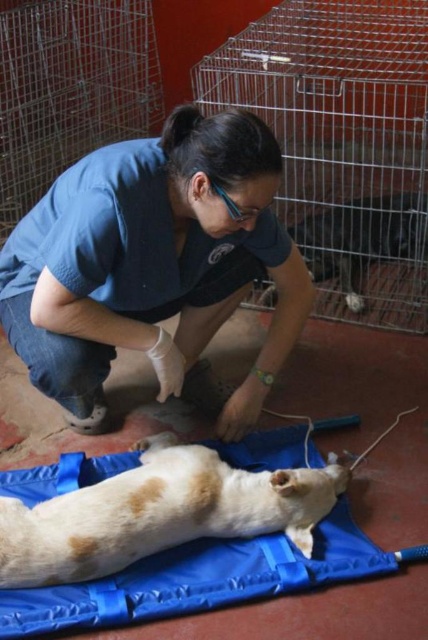
You are a veterinary assistant and need to place a new blue fabric mat in the examination room. The current blue fabric at center is already there. How does the size of the new mat compare to the white fur dog at center?

The blue fabric at center is bigger than the white fur dog at center, so the new blue fabric mat should be at least as large as the existing one to accommodate the dog properly.

You are a veterinarian trying to place a bandage on the dog. The bandage is 12 inches long. Can you fit the bandage between the blue fabric at center and the light brown fur at center without overlapping either?

The blue fabric at center and light brown fur at center are 17.20 inches apart. Since the bandage is only 12 inches long, there is enough space between them to place the bandage without overlapping either.

You are a veterinary assistant standing at the point with coordinates point (103, 200) and need to move towards point (50, 545). Based on the scene description, which direction should you move to reach your destination?

Point (103, 200) is in front of point (50, 545). Therefore, to move from point (103, 200) to point (50, 545), you should move backward.